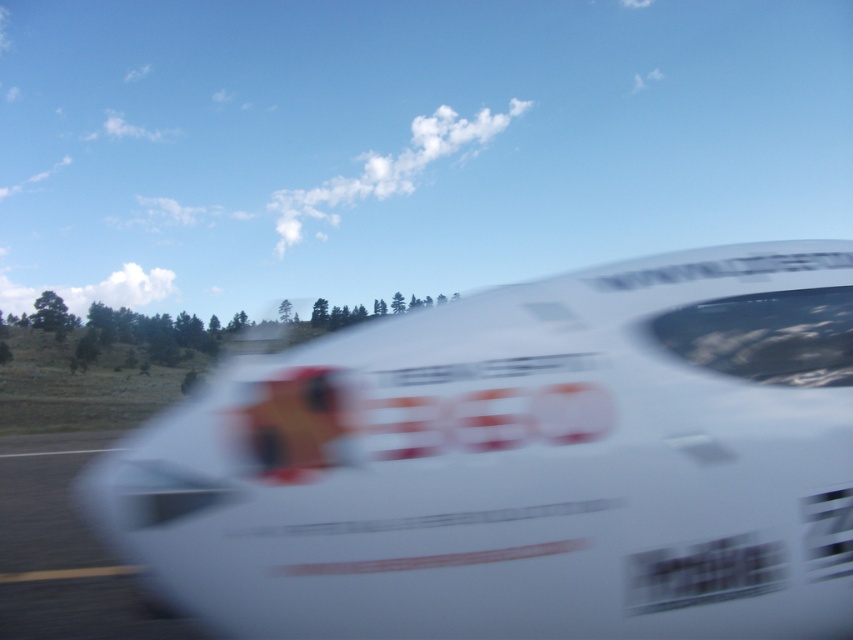
Is point (640, 586) behind point (54, 614)?

No, it is not.

Is white glossy airplane at center smaller than white glossy race track at lower left?

No.

Is point (602, 426) in front of point (119, 611)?

Yes.

At what (x,y) coordinates should I click in order to perform the action: click on white glossy airplane at center. Please return your answer as a coordinate pair (x, y). Looking at the image, I should click on pyautogui.click(x=521, y=464).